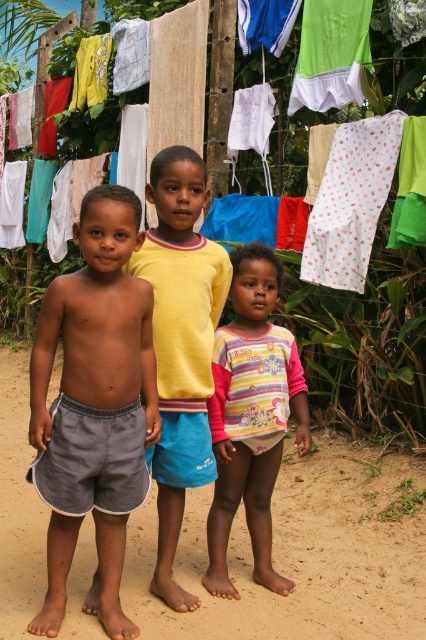
Locate an element on the screen. Image resolution: width=426 pixels, height=640 pixels. gray fabric shorts at left is located at coordinates (95, 403).

Which of these two, gray fabric shorts at left or striped cotton shirt at center, stands shorter?

striped cotton shirt at center is shorter.

What are the coordinates of `gray fabric shorts at left` in the screenshot? It's located at (95, 403).

Between gray fabric shorts at left and white cotton pants at center, which one has more height?

gray fabric shorts at left

Is gray fabric shorts at left bigger than white cotton pants at center?

Correct, gray fabric shorts at left is larger in size than white cotton pants at center.

Find the location of `gray fabric shorts at left`. gray fabric shorts at left is located at coordinates (95, 403).

This screenshot has height=640, width=426. In order to click on gray fabric shorts at left in this screenshot , I will do coord(95,403).

Is point (40, 625) positioned before point (322, 179)?

Yes, it is in front of point (322, 179).

The image size is (426, 640). In order to click on gray fabric shorts at left in this screenshot , I will do pyautogui.click(x=95, y=403).

Locate an element on the screen. gray fabric shorts at left is located at coordinates (95, 403).